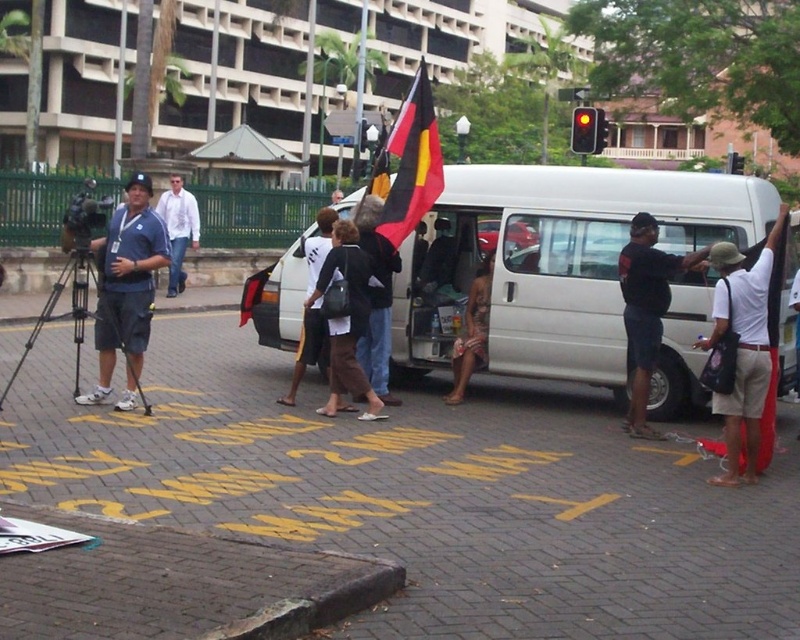
You are a delivery person who needs to place a package between the black fabric bag at center and the brown leather sandals at center. The package requires a minimum of 1.8 meters of space. Can you fit it there?

The distance between the black fabric bag at center and the brown leather sandals at center is 1.73 meters, which is less than the required 1.8 meters. Therefore, the package cannot be placed there.

You are a photographer standing at the scene described. You notice the black fabric bag at center and the brown leather sandals at center. Which object is closer to you?

The black fabric bag at center is positioned over the brown leather sandals at center, meaning it is closer to you.

Based on the photo, you are a photographer standing behind the man with the camera. You notice the black fabric flag at center and the white shirt at center in your frame. Which object should you adjust your focus to ensure it appears clearer in the photo?

You should focus on the black fabric flag at center because it is closer to the viewer than the white shirt at center, so adjusting focus to the closer object will make it clearer.